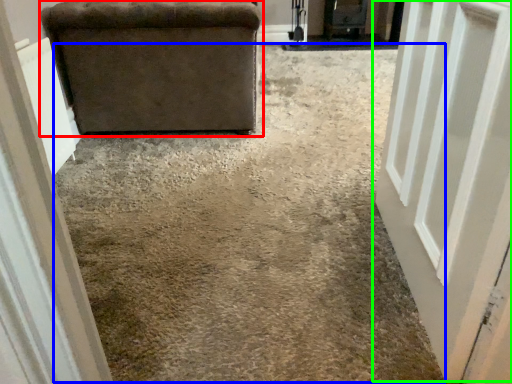
Question: Estimate the real-world distances between objects in this image. Which object is farther from furniture (highlighted by a red box), concrete (highlighted by a blue box) or door (highlighted by a green box)?

Choices:
 (A) concrete
 (B) door

Answer: (B)